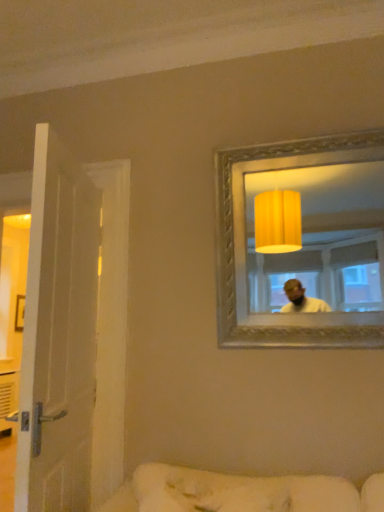
Find the location of a particular element. The height and width of the screenshot is (512, 384). white fabric couch at lower center is located at coordinates (241, 492).

Does point (331, 492) come in front of point (93, 234)?

Yes, it is in front of point (93, 234).

Considering the sizes of objects white fabric couch at lower center and white wooden door at left in the image provided, who is wider, white fabric couch at lower center or white wooden door at left?

white wooden door at left is wider.

Are white fabric couch at lower center and white wooden door at left far apart?

white fabric couch at lower center is near white wooden door at left, not far away.

Is white wooden door at left not inside white fabric couch at lower center?

Yes.

Between white wooden door at left and white fabric couch at lower center, which one appears on the right side from the viewer's perspective?

From the viewer's perspective, white fabric couch at lower center appears more on the right side.

From a real-world perspective, is white wooden door at left on white fabric couch at lower center?

Indeed, from a real-world perspective, white wooden door at left stands above white fabric couch at lower center.

In terms of height, does gold textured mirror at upper right look taller or shorter compared to white fabric couch at lower center?

Clearly, gold textured mirror at upper right is taller compared to white fabric couch at lower center.

Is gold textured mirror at upper right not near white fabric couch at lower center?

Absolutely, gold textured mirror at upper right is distant from white fabric couch at lower center.

Does point (307, 256) lie behind point (161, 474)?

Yes, point (307, 256) is behind point (161, 474).

Is the depth of gold textured mirror at upper right less than that of white fabric couch at lower center?

No, the depth of gold textured mirror at upper right is greater than that of white fabric couch at lower center.

Is gold textured mirror at upper right inside white fabric couch at lower center?

No.

Who is bigger, white fabric couch at lower center or gold textured mirror at upper right?

With larger size is gold textured mirror at upper right.

Which is more to the left, white fabric couch at lower center or gold textured mirror at upper right?

Positioned to the left is white fabric couch at lower center.

Based on the photo, is white wooden door at left positioned with its back to gold textured mirror at upper right?

white wooden door at left is not turned away from gold textured mirror at upper right.

In terms of width, does white wooden door at left look wider or thinner when compared to gold textured mirror at upper right?

white wooden door at left is wider than gold textured mirror at upper right.

Is white wooden door at left in contact with gold textured mirror at upper right?

They are not placed beside each other.

Is white wooden door at left positioned beyond the bounds of gold textured mirror at upper right?

Yes, white wooden door at left is not within gold textured mirror at upper right.

You are a GUI agent. You are given a task and a screenshot of the screen. Output one action in this format:
    pyautogui.click(x=<x>, y=<y>)
    Task: Click on the door on the left of gold textured mirror at upper right
    This screenshot has width=384, height=512.
    Given the screenshot: What is the action you would take?
    pyautogui.click(x=58, y=334)

Looking at their sizes, would you say gold textured mirror at upper right is wider or thinner than white wooden door at left?

Considering their sizes, gold textured mirror at upper right looks slimmer than white wooden door at left.

From the image's perspective, is gold textured mirror at upper right located above or below white wooden door at left?

From the image's perspective, gold textured mirror at upper right appears above white wooden door at left.

Between gold textured mirror at upper right and white wooden door at left, which one appears on the right side from the viewer's perspective?

gold textured mirror at upper right is more to the right.

Identify the location of studio couch below the white wooden door at left (from the image's perspective). This screenshot has height=512, width=384. (241, 492).

Where is `studio couch below the white wooden door at left (from a real-world perspective)`? studio couch below the white wooden door at left (from a real-world perspective) is located at coordinates (241, 492).

Estimate the real-world distances between objects in this image. Which object is closer to white fabric couch at lower center, gold textured mirror at upper right or white wooden door at left?

white wooden door at left.

Considering their positions, is white wooden door at left positioned further to gold textured mirror at upper right than white fabric couch at lower center?

white wooden door at left lies further to gold textured mirror at upper right than the other object.

From the picture: When comparing their distances from gold textured mirror at upper right, does white fabric couch at lower center or white wooden door at left seem further?

Among the two, white wooden door at left is located further to gold textured mirror at upper right.

Looking at the image, which one is located further to white wooden door at left, white fabric couch at lower center or gold textured mirror at upper right?

gold textured mirror at upper right.

Based on their spatial positions, is gold textured mirror at upper right or white fabric couch at lower center closer to white wooden door at left?

Based on the image, white fabric couch at lower center appears to be nearer to white wooden door at left.

Which object lies further to the anchor point white fabric couch at lower center, white wooden door at left or gold textured mirror at upper right?

gold textured mirror at upper right.

This screenshot has width=384, height=512. I want to click on studio couch between white wooden door at left and gold textured mirror at upper right, so click(241, 492).